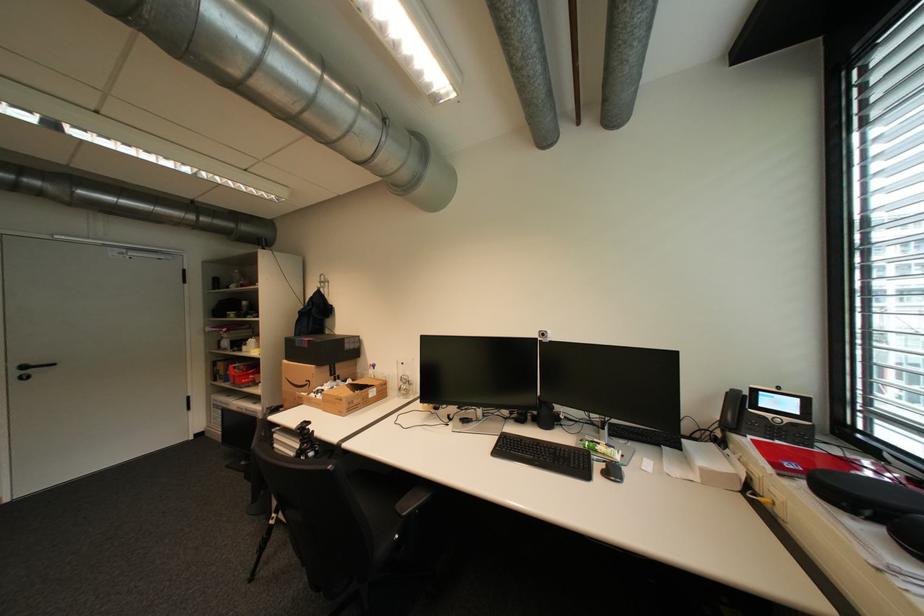
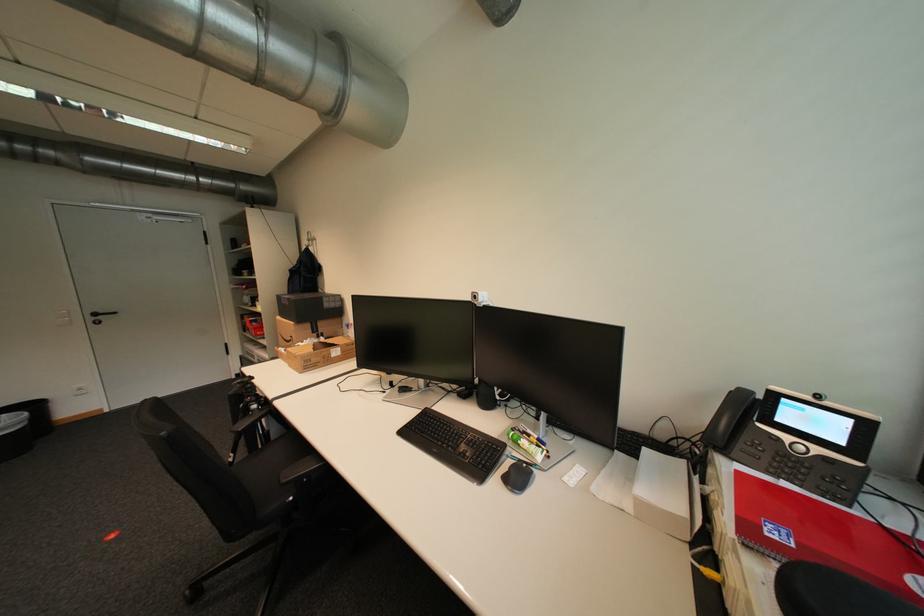
In the second image, find the point that corresponds to (x=314, y=382) in the first image.

(299, 338)